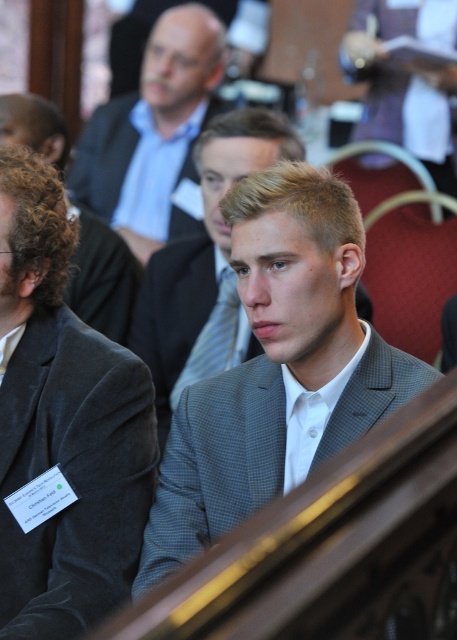
Question: Is matte gray suit at center to the left of gray wool suit at center from the viewer's perspective?

Choices:
 (A) no
 (B) yes

Answer: (B)

Question: Based on their relative distances, which object is nearer to the blue striped tie at center?

Choices:
 (A) curly hair at left
 (B) gray textured suit at center

Answer: (B)

Question: Which point is closer to the camera?

Choices:
 (A) gray wool suit at center
 (B) matte gray suit at center

Answer: (A)

Question: Can you confirm if gray checkered suit at center is positioned below dark gray suit at center?

Choices:
 (A) no
 (B) yes

Answer: (B)

Question: Which of the following is the closest to the observer?

Choices:
 (A) (72, 291)
 (B) (297, 413)
 (C) (414, 134)
 (D) (211, 269)

Answer: (B)

Question: Where is matte gray suit at center located in relation to gray wool suit at center in the image?

Choices:
 (A) left
 (B) right

Answer: (A)